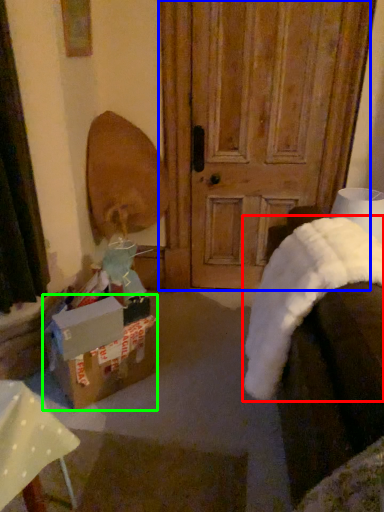
Question: Considering the real-world distances, which object is farthest from blanket (highlighted by a red box)? door (highlighted by a blue box) or box (highlighted by a green box)?

Choices:
 (A) door
 (B) box

Answer: (A)